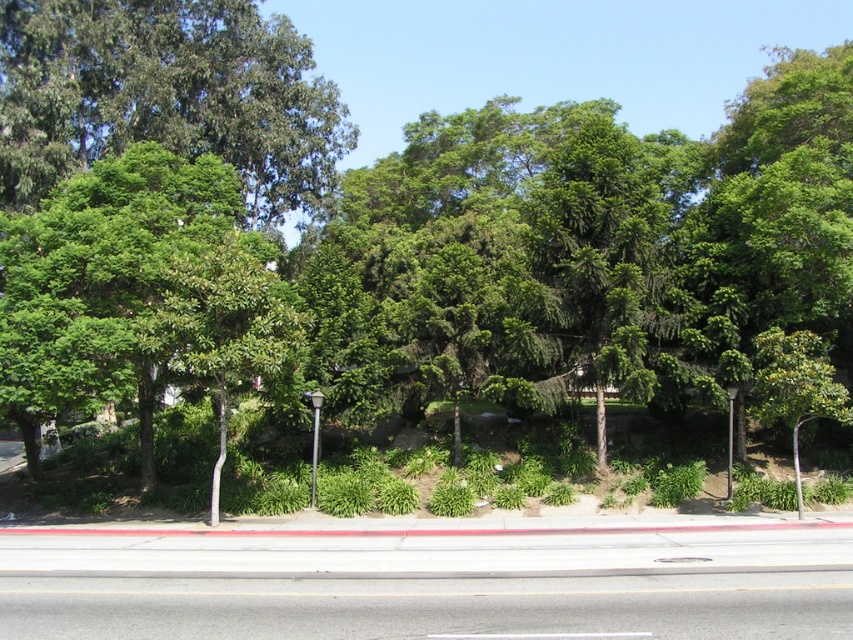
How much distance is there between green leafy tree at upper left and black metal pole at center?

They are 15.07 meters apart.

Measure the distance between green leafy tree at upper left and camera.

green leafy tree at upper left and camera are 26.10 meters apart from each other.

The width and height of the screenshot is (853, 640). What are the coordinates of `green leafy tree at upper left` in the screenshot? It's located at (165, 93).

Can you confirm if green leafy tree at center is wider than black metal pole at center?

Indeed, green leafy tree at center has a greater width compared to black metal pole at center.

What do you see at coordinates (119, 284) in the screenshot? I see `green leafy tree at center` at bounding box center [119, 284].

Who is more distant from viewer, (79, 225) or (308, 394)?

Point (308, 394)

Locate an element on the screen. The image size is (853, 640). green leafy tree at center is located at coordinates (119, 284).

How far apart are green leafy tree at upper left and green leafy tree at center?

green leafy tree at upper left and green leafy tree at center are 10.71 meters apart.

Is green leafy tree at upper left positioned in front of green leafy tree at center?

No, it is not.

Describe the element at coordinates (165, 93) in the screenshot. Image resolution: width=853 pixels, height=640 pixels. I see `green leafy tree at upper left` at that location.

I want to click on green leafy tree at upper left, so click(x=165, y=93).